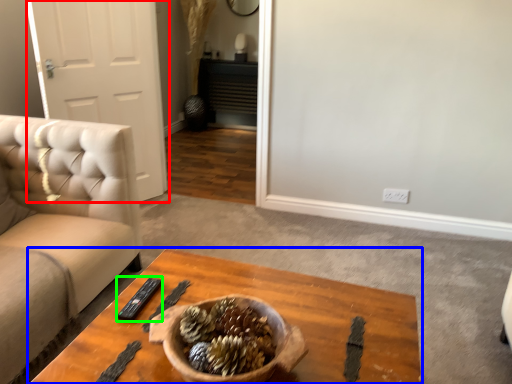
Question: Considering the real-world distances, which object is closest to door (highlighted by a red box)? coffee table (highlighted by a blue box) or remote (highlighted by a green box).

Choices:
 (A) coffee table
 (B) remote

Answer: (A)